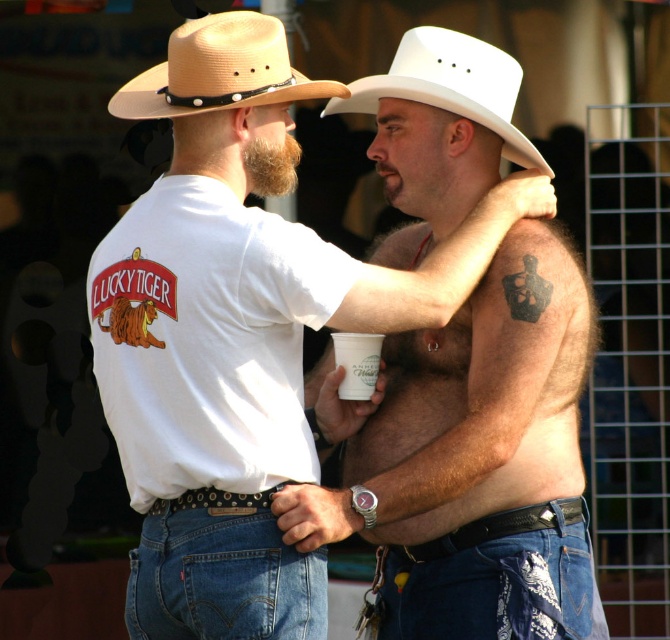
In the scene shown: Can you confirm if denim jeans at lower center is positioned below white paper cup at upper center?

Yes, denim jeans at lower center is below white paper cup at upper center.

Is denim jeans at lower center taller than white paper cup at upper center?

Yes.

Is point (206, 576) in front of point (332, 336)?

Yes, it is in front of point (332, 336).

I want to click on denim jeans at lower center, so click(220, 572).

Can you confirm if denim jeans at lower right is shorter than white felt cowboy hat at upper center?

Incorrect, denim jeans at lower right's height does not fall short of white felt cowboy hat at upper center's.

Which is in front, point (450, 624) or point (470, 40)?

Point (450, 624) is more forward.

Does point (472, 540) come behind point (480, 116)?

No.

Image resolution: width=670 pixels, height=640 pixels. In order to click on denim jeans at lower right in this screenshot , I will do `click(490, 580)`.

Which is more to the right, white felt cowboy hat at upper center or white paper cup at upper center?

white felt cowboy hat at upper center

The height and width of the screenshot is (640, 670). Describe the element at coordinates (450, 84) in the screenshot. I see `white felt cowboy hat at upper center` at that location.

Describe the element at coordinates (450, 84) in the screenshot. The width and height of the screenshot is (670, 640). I see `white felt cowboy hat at upper center` at that location.

Image resolution: width=670 pixels, height=640 pixels. What are the coordinates of `white felt cowboy hat at upper center` in the screenshot? It's located at (450, 84).